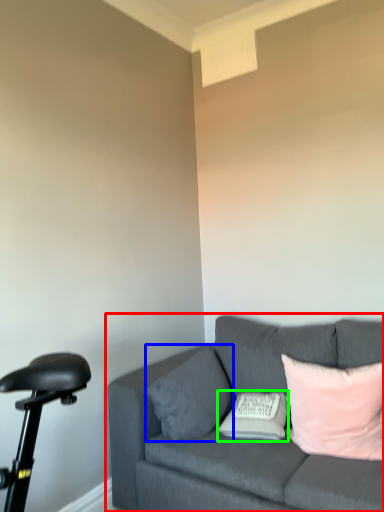
Question: Estimate the real-world distances between objects in this image. Which object is farther from studio couch (highlighted by a red box), pillow (highlighted by a blue box) or pillow (highlighted by a green box)?

Choices:
 (A) pillow
 (B) pillow

Answer: (B)